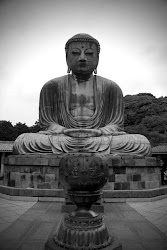
Find the location of a particular element. statue is located at coordinates (88, 118).